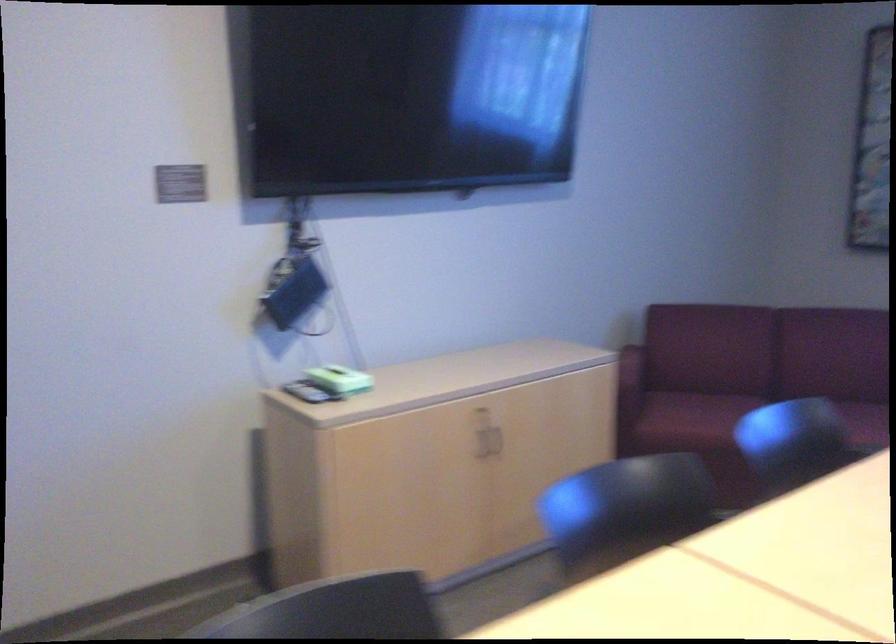
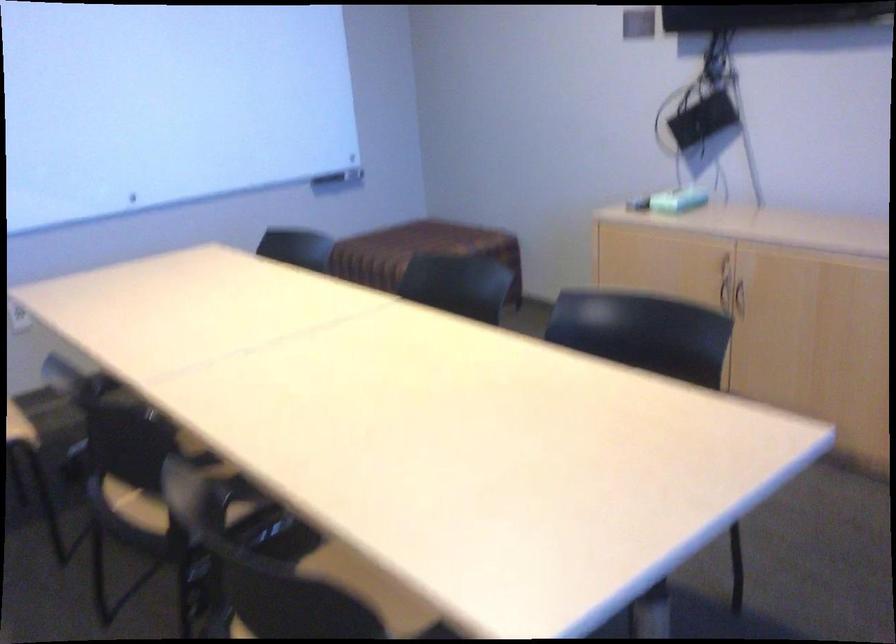
The point at (341, 383) is marked in the first image. Where is the corresponding point in the second image?

(677, 200)